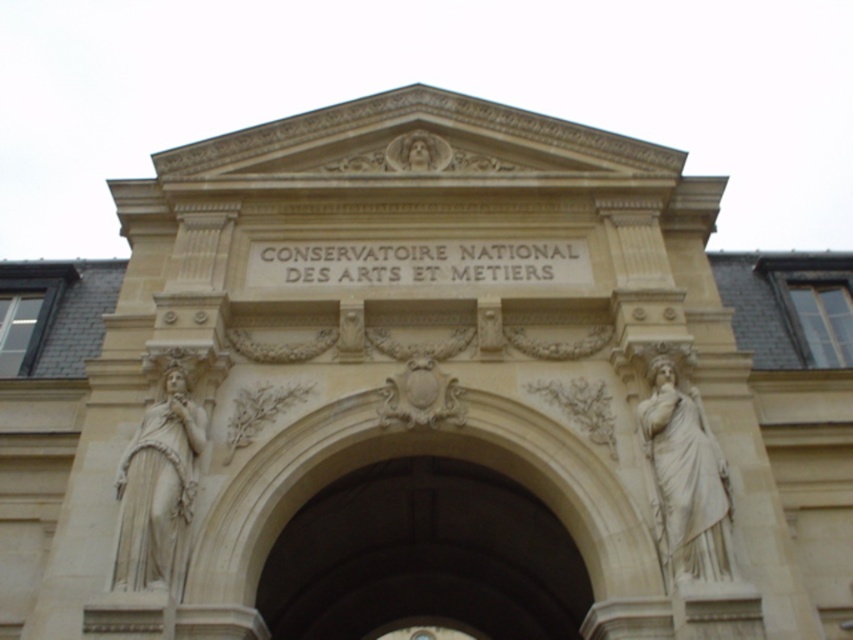
Question: Does white marble statue at right have a greater width compared to white stone statue at left?

Choices:
 (A) yes
 (B) no

Answer: (B)

Question: Which point is farther to the camera?

Choices:
 (A) white marble statue at right
 (B) white stone statue at left

Answer: (A)

Question: Among these points, which one is nearest to the camera?

Choices:
 (A) (140, 467)
 (B) (677, 522)

Answer: (B)

Question: Is white marble statue at right below white stone statue at left?

Choices:
 (A) yes
 (B) no

Answer: (B)

Question: Does white marble statue at right have a larger size compared to white stone statue at left?

Choices:
 (A) no
 (B) yes

Answer: (A)